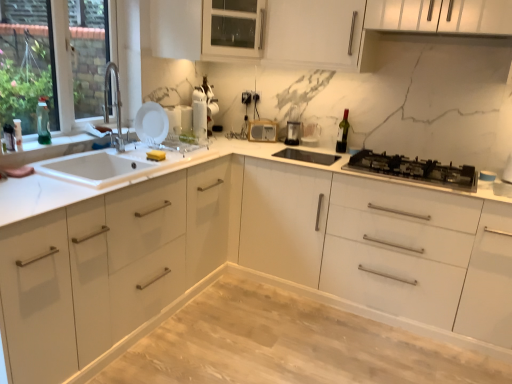
Find the location of a particular element. The width and height of the screenshot is (512, 384). white matte plate at upper left, which is counted as the fourth appliance, starting from the back is located at coordinates (151, 123).

Describe the element at coordinates (414, 170) in the screenshot. I see `black matte gas stove at right` at that location.

Identify the location of green glass wine bottle at upper right. (343, 133).

What do you see at coordinates (262, 130) in the screenshot? I see `wooden radio at center, which is the second appliance in right-to-left order` at bounding box center [262, 130].

The width and height of the screenshot is (512, 384). What do you see at coordinates (294, 292) in the screenshot? I see `light wood/dark stain dining table at center` at bounding box center [294, 292].

Locate an element on the screen. light wood/dark stain dining table at center is located at coordinates (294, 292).

This screenshot has height=384, width=512. I want to click on white matte plate at upper left, marked as the first appliance in a left-to-right arrangement, so click(x=151, y=123).

Does black matte gas stove at right turn towards white matte plate at upper left, marked as the first appliance in a left-to-right arrangement?

No.

From the image's perspective, would you say black matte gas stove at right is positioned over white matte plate at upper left, which is counted as the fourth appliance, starting from the back?

Incorrect, from the image's perspective, black matte gas stove at right is lower than white matte plate at upper left, which is counted as the fourth appliance, starting from the back.

Is point (446, 167) farther from viewer compared to point (155, 133)?

No, (446, 167) is closer to viewer.

Find the location of a particular element. The height and width of the screenshot is (384, 512). the 2nd bottle below the black plastic coffee maker at center, the 2th appliance when ordered from back to front (from the image's perspective) is located at coordinates (18, 134).

Is translucent plastic bottle at left, acting as the 2th bottle starting from the back, at the left side of black plastic coffee maker at center, which appears as the 4th appliance when viewed from the left?

Indeed, translucent plastic bottle at left, acting as the 2th bottle starting from the back, is positioned on the left side of black plastic coffee maker at center, which appears as the 4th appliance when viewed from the left.

Between point (20, 131) and point (293, 140), which one is positioned in front?

The point (20, 131) is more forward.

Which is in front, translucent plastic bottle at left, the first bottle when ordered from front to back, or black plastic coffee maker at center, the first appliance when ordered from right to left?

translucent plastic bottle at left, the first bottle when ordered from front to back.

Is translucent plastic bottle at left, the first bottle when ordered from front to back, next to white glossy kettle at upper center, which is the second appliance from left to right?

No, translucent plastic bottle at left, the first bottle when ordered from front to back, is not beside white glossy kettle at upper center, which is the second appliance from left to right.

Considering the sizes of objects translucent plastic bottle at left, the first bottle when ordered from front to back, and white glossy kettle at upper center, which is the 3th appliance in right-to-left order, in the image provided, who is wider, translucent plastic bottle at left, the first bottle when ordered from front to back, or white glossy kettle at upper center, which is the 3th appliance in right-to-left order,?

white glossy kettle at upper center, which is the 3th appliance in right-to-left order, is wider.

Measure the distance from translucent plastic bottle at left, acting as the 2th bottle starting from the back, to white glossy kettle at upper center, which is the 3th appliance in right-to-left order.

3.90 feet.

From the image's perspective, would you say translucent plastic bottle at left, the first bottle viewed from the left, is positioned over white glossy kettle at upper center, which is the second appliance from left to right?

No, from the image's perspective, translucent plastic bottle at left, the first bottle viewed from the left, is not above white glossy kettle at upper center, which is the second appliance from left to right.

Which is more to the left, translucent plastic bottle at left, which is counted as the second bottle, starting from the right, or green glass wine bottle at upper right?

translucent plastic bottle at left, which is counted as the second bottle, starting from the right, is more to the left.

Is green glass wine bottle at upper right surrounded by translucent plastic bottle at left, the first bottle viewed from the left?

Definitely not — green glass wine bottle at upper right is not inside translucent plastic bottle at left, the first bottle viewed from the left.

Is point (18, 144) closer or farther from the camera than point (343, 130)?

Point (18, 144) appears to be closer to the viewer than point (343, 130).

From the green glass wine bottle at upper right, count 2nd bottles forward and point to it. Please provide its 2D coordinates.

[(18, 134)]

You are a GUI agent. You are given a task and a screenshot of the screen. Output one action in this format:
    pyautogui.click(x=<x>, y=<y>)
    Task: Click on the window sill that is on the right side of translucent plastic bottle at left, the first bottle viewed from the left
    
    Given the screenshot: What is the action you would take?
    pyautogui.click(x=70, y=139)

Which is more to the left, translucent plastic bottle at left, the first bottle viewed from the left, or white glossy sink at left?

Positioned to the left is translucent plastic bottle at left, the first bottle viewed from the left.

From a real-world perspective, who is located higher, translucent plastic bottle at left, acting as the 2th bottle starting from the back, or white glossy sink at left?

translucent plastic bottle at left, acting as the 2th bottle starting from the back, is physically above.

Is translucent plastic bottle at left, the first bottle viewed from the left, directly adjacent to white glossy sink at left?

translucent plastic bottle at left, the first bottle viewed from the left, is not next to white glossy sink at left, and they're not touching.

Which is more to the right, white glossy cabinet at center, arranged as the second cabinetry when viewed from the top, or light wood/dark stain dining table at center?

light wood/dark stain dining table at center is more to the right.

Is white glossy cabinet at center, marked as the first cabinetry in a bottom-to-top arrangement, taller or shorter than light wood/dark stain dining table at center?

Clearly, white glossy cabinet at center, marked as the first cabinetry in a bottom-to-top arrangement, is taller compared to light wood/dark stain dining table at center.

From the image's perspective, which one is positioned higher, white glossy cabinet at center, marked as the first cabinetry in a bottom-to-top arrangement, or light wood/dark stain dining table at center?

white glossy cabinet at center, marked as the first cabinetry in a bottom-to-top arrangement.

The image size is (512, 384). Find the location of `dinning table below the white glossy cabinet at center, arranged as the second cabinetry when viewed from the top (from the image's perspective)`. dinning table below the white glossy cabinet at center, arranged as the second cabinetry when viewed from the top (from the image's perspective) is located at coordinates (294, 292).

Is white matte plate at upper left, marked as the first appliance in a left-to-right arrangement, turned away from clear glass window at left?

white matte plate at upper left, marked as the first appliance in a left-to-right arrangement, does not have its back to clear glass window at left.

Considering the sizes of objects white matte plate at upper left, the 1th appliance from the front, and clear glass window at left in the image provided, who is bigger, white matte plate at upper left, the 1th appliance from the front, or clear glass window at left?

With larger size is clear glass window at left.

From a real-world perspective, who is located higher, white matte plate at upper left, the 1th appliance from the front, or clear glass window at left?

In real-world perspective, clear glass window at left is above.

Find the location of `gas stove located underneath the white matte plate at upper left, which is counted as the fourth appliance, starting from the back (from a real-world perspective)`. gas stove located underneath the white matte plate at upper left, which is counted as the fourth appliance, starting from the back (from a real-world perspective) is located at coordinates (414, 170).

Find the location of `the 2nd appliance above the translucent plastic bottle at left, the first bottle when ordered from front to back (from the image's perspective)`. the 2nd appliance above the translucent plastic bottle at left, the first bottle when ordered from front to back (from the image's perspective) is located at coordinates (293, 133).

Consider the image. From the image, which object appears to be farther from black matte gas stove at right, white glossy cabinet at center, marked as the first cabinetry in a bottom-to-top arrangement, or green glass wine bottle at upper right?

white glossy cabinet at center, marked as the first cabinetry in a bottom-to-top arrangement, lies further to black matte gas stove at right than the other object.

Based on their spatial positions, is wooden radio at center, the first appliance from the back, or white glossy sink at left further from white matte plate at upper left, the 1th appliance from the front?

Among the two, wooden radio at center, the first appliance from the back, is located further to white matte plate at upper left, the 1th appliance from the front.

From the picture: Which object lies further to the anchor point light wood/dark stain dining table at center, white glossy cabinet at center, arranged as the second cabinetry when viewed from the top, or black matte gas stove at right?

black matte gas stove at right is further to light wood/dark stain dining table at center.

Based on their spatial positions, is wooden radio at center, which appears as the third appliance when viewed from the left, or black plastic coffee maker at center, which is counted as the 3th appliance, starting from the front, closer to white matte plate at upper left, marked as the first appliance in a left-to-right arrangement?

wooden radio at center, which appears as the third appliance when viewed from the left.

Estimate the real-world distances between objects in this image. Which object is further from green glass bottle at left, the 1th bottle positioned from the right, green glass wine bottle at upper right or translucent plastic bottle at left, the first bottle when ordered from front to back?

green glass wine bottle at upper right is positioned further to the anchor green glass bottle at left, the 1th bottle positioned from the right.

Estimate the real-world distances between objects in this image. Which object is further from green glass wine bottle at upper right, white matte plate at upper left, the 4th appliance positioned from the right, or white glossy sink at left?

The object further to green glass wine bottle at upper right is white glossy sink at left.

Looking at the image, which one is located further to white matte plate at upper left, which is counted as the fourth appliance, starting from the back, black plastic coffee maker at center, which is counted as the 3th appliance, starting from the front, or white glossy kettle at upper center, which is the 3th appliance in right-to-left order?

Among the two, black plastic coffee maker at center, which is counted as the 3th appliance, starting from the front, is located further to white matte plate at upper left, which is counted as the fourth appliance, starting from the back.

From the image, which object appears to be farther from clear glass window at left, black plastic coffee maker at center, the 2th appliance when ordered from back to front, or translucent plastic bottle at left, which is counted as the second bottle, starting from the right?

black plastic coffee maker at center, the 2th appliance when ordered from back to front.

You are a GUI agent. You are given a task and a screenshot of the screen. Output one action in this format:
    pyautogui.click(x=<x>, y=<y>)
    Task: Click on the bottle between translucent plastic bottle at left, acting as the 2th bottle starting from the back, and black matte gas stove at right, in the horizontal direction
    
    Given the screenshot: What is the action you would take?
    pyautogui.click(x=42, y=121)

I want to click on wine bottle located between white glossy cabinet at center, marked as the first cabinetry in a bottom-to-top arrangement, and wooden radio at center, which is the second appliance in right-to-left order, in the depth direction, so point(343,133).

Locate an element on the screen. Image resolution: width=512 pixels, height=384 pixels. wine bottle between light wood/dark stain dining table at center and wooden radio at center, which is the second appliance in right-to-left order, from front to back is located at coordinates (343, 133).

At what (x,y) coordinates should I click in order to perform the action: click on cabinetry situated between white glossy kettle at upper center, which is the second appliance from left to right, and black plastic coffee maker at center, which appears as the 4th appliance when viewed from the left, from left to right. Please return your answer as a coordinate pair (x, y). Image resolution: width=512 pixels, height=384 pixels. Looking at the image, I should click on (207, 29).